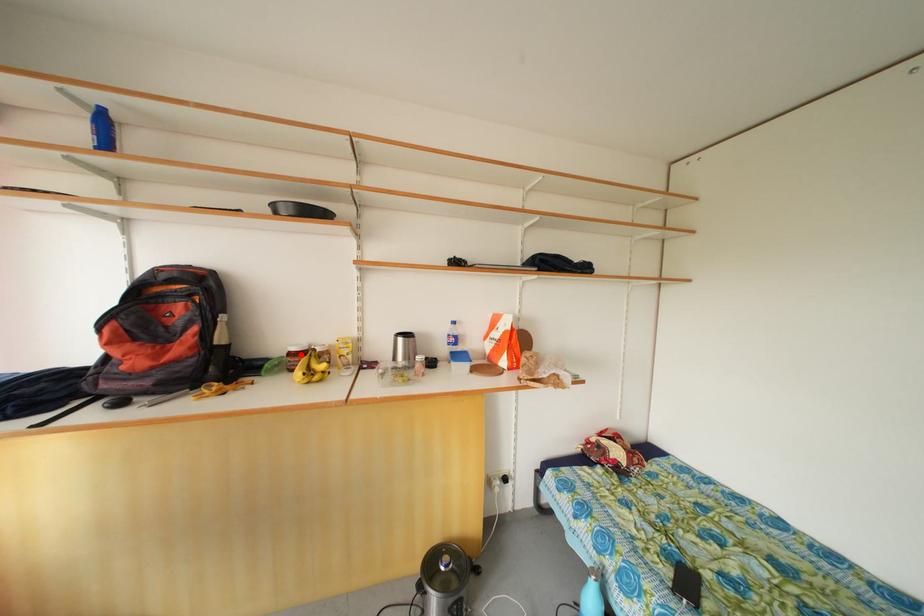
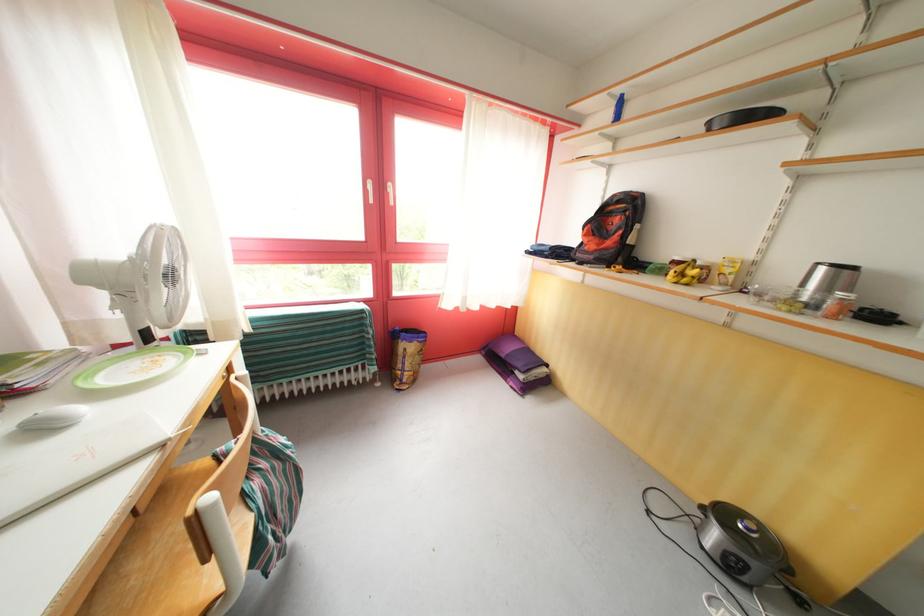
Where in the second image is the point corresponding to the highlighted location from the first image?

(684, 264)